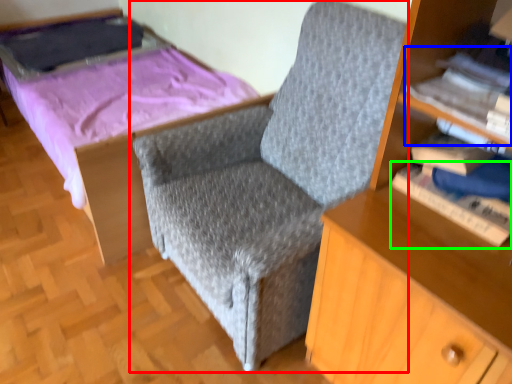
Question: Considering the real-world distances, which object is farthest from chair (highlighted by a red box)? book (highlighted by a blue box) or book (highlighted by a green box)?

Choices:
 (A) book
 (B) book

Answer: (A)